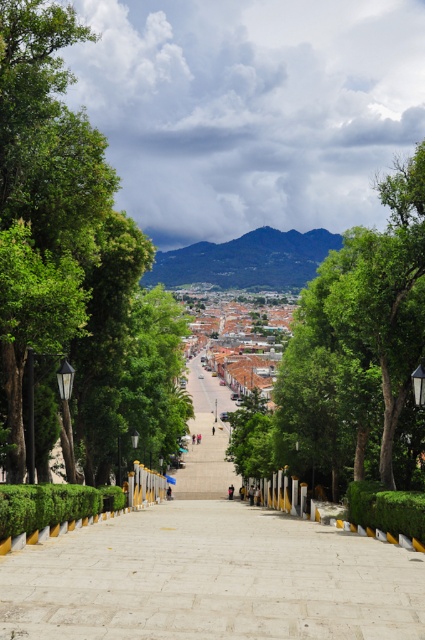
Question: Does white stone steps at center have a smaller size compared to green leafy hedge at lower left?

Choices:
 (A) yes
 (B) no

Answer: (B)

Question: Which of the following is the closest to the observer?

Choices:
 (A) click(360, 497)
 (B) click(51, 33)
 (C) click(379, 310)

Answer: (B)

Question: Can you confirm if green leafy tree at upper center is positioned above green leafy hedge at center?

Choices:
 (A) yes
 (B) no

Answer: (A)

Question: Which object appears closest to the camera in this image?

Choices:
 (A) green leafy hedge at lower left
 (B) green leafy tree at center
 (C) smooth concrete steps at center
 (D) white stone steps at center

Answer: (D)

Question: Can you confirm if white stone steps at center is positioned below smooth concrete steps at center?

Choices:
 (A) yes
 (B) no

Answer: (B)

Question: Which object is farther from the camera taking this photo?

Choices:
 (A) green leafy tree at upper center
 (B) green leafy hedge at center
 (C) green leafy hedge at lower left

Answer: (A)